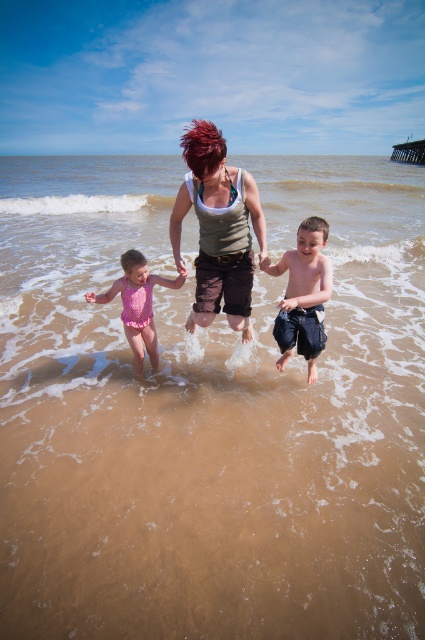
Between matte gray tank top at center and blue denim shorts at center, which one has more height?

With more height is blue denim shorts at center.

The height and width of the screenshot is (640, 425). What do you see at coordinates (218, 227) in the screenshot?
I see `matte gray tank top at center` at bounding box center [218, 227].

Is point (209, 317) in front of point (325, 333)?

Yes, point (209, 317) is in front of point (325, 333).

Find the location of `matte gray tank top at center`. matte gray tank top at center is located at coordinates (218, 227).

Which is more to the left, matte gray tank top at center or pink matte swimsuit at center?

pink matte swimsuit at center is more to the left.

Does point (238, 276) come closer to viewer compared to point (125, 323)?

Yes, point (238, 276) is in front of point (125, 323).

This screenshot has width=425, height=640. What are the coordinates of `matte gray tank top at center` in the screenshot? It's located at (218, 227).

Which is more to the right, blue denim shorts at center or pink matte swimsuit at center?

Positioned to the right is blue denim shorts at center.

Is point (289, 339) closer to viewer compared to point (122, 314)?

Yes.

Locate an element on the screen. The image size is (425, 640). blue denim shorts at center is located at coordinates (303, 294).